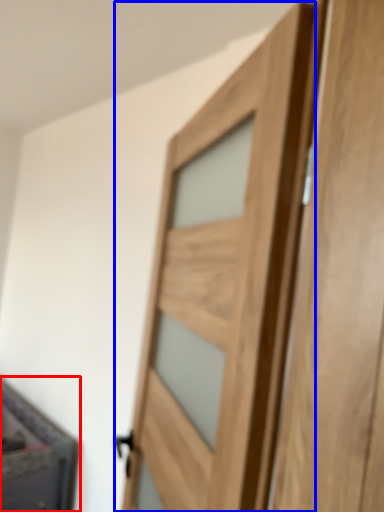
Question: Which object is closer to the camera taking this photo, cabinetry (highlighted by a red box) or door (highlighted by a blue box)?

Choices:
 (A) cabinetry
 (B) door

Answer: (B)